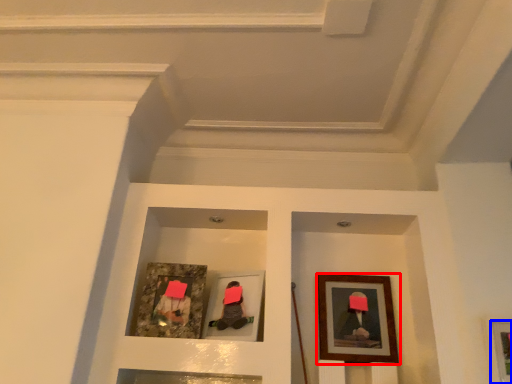
Question: Among these objects, which one is nearest to the camera, picture frame (highlighted by a red box) or picture frame (highlighted by a blue box)?

Choices:
 (A) picture frame
 (B) picture frame

Answer: (B)